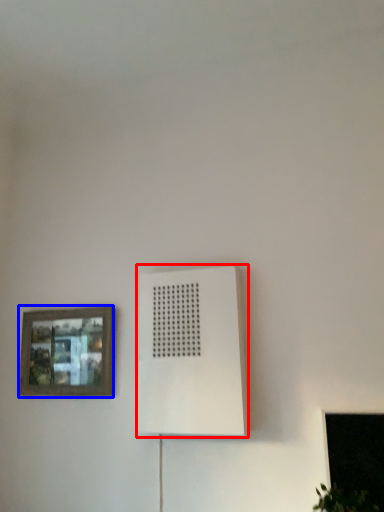
Question: Which of the following is the farthest to the observer, air conditioning (highlighted by a red box) or picture frame (highlighted by a blue box)?

Choices:
 (A) air conditioning
 (B) picture frame

Answer: (B)